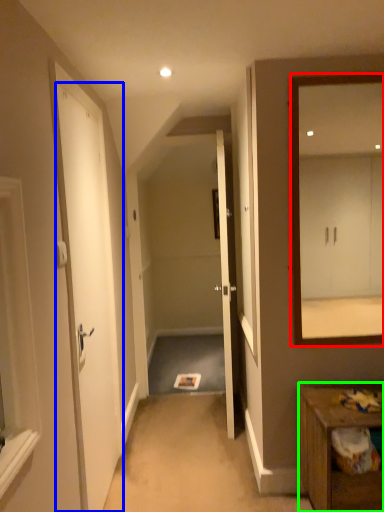
Question: Which object is the closest to the mirror (highlighted by a red box)? Choose among these: door (highlighted by a blue box) or table (highlighted by a green box).

Choices:
 (A) door
 (B) table

Answer: (A)